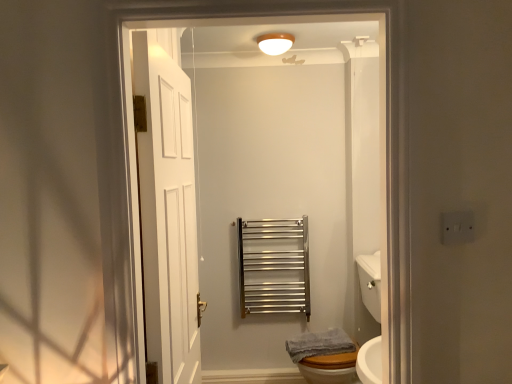
Question: From their relative heights in the image, would you say white glossy sink at lower right is taller or shorter than white wooden door at center, the second door when ordered from left to right?

Choices:
 (A) tall
 (B) short

Answer: (B)

Question: Considering the relative positions of white glossy sink at lower right and white wooden door at center, which is the first door in right-to-left order, in the image provided, is white glossy sink at lower right to the left or to the right of white wooden door at center, which is the first door in right-to-left order,?

Choices:
 (A) left
 (B) right

Answer: (B)

Question: Estimate the real-world distances between objects in this image. Which object is closer to the white wooden door at left, the 1th door viewed from the left?

Choices:
 (A) white glossy light fixture at upper center
 (B) white glossy sink at lower right
 (C) white wooden door at center, the first door in the front-to-back sequence
 (D) satin nickel towel rail at center
 (E) gray cotton towel at lower right

Answer: (C)

Question: Which object is positioned farthest from the gray cotton towel at lower right?

Choices:
 (A) white wooden door at center, which is the first door in right-to-left order
 (B) white glossy sink at lower right
 (C) satin nickel towel rail at center
 (D) white wooden door at left, the second door in the right-to-left sequence
 (E) white glossy light fixture at upper center

Answer: (E)